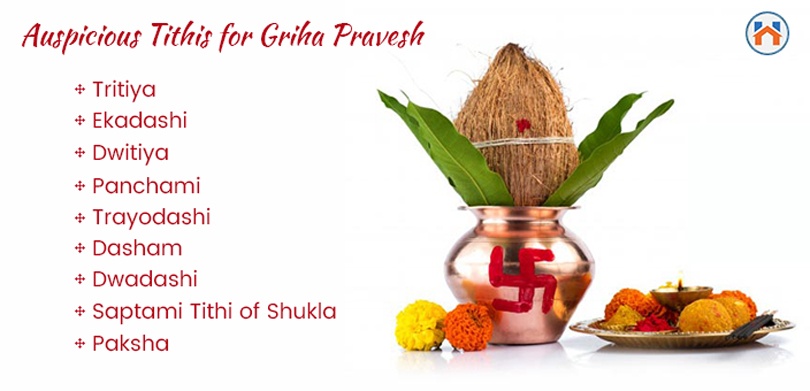
What are the coordinates of `vase` in the screenshot? It's located at (574, 273).